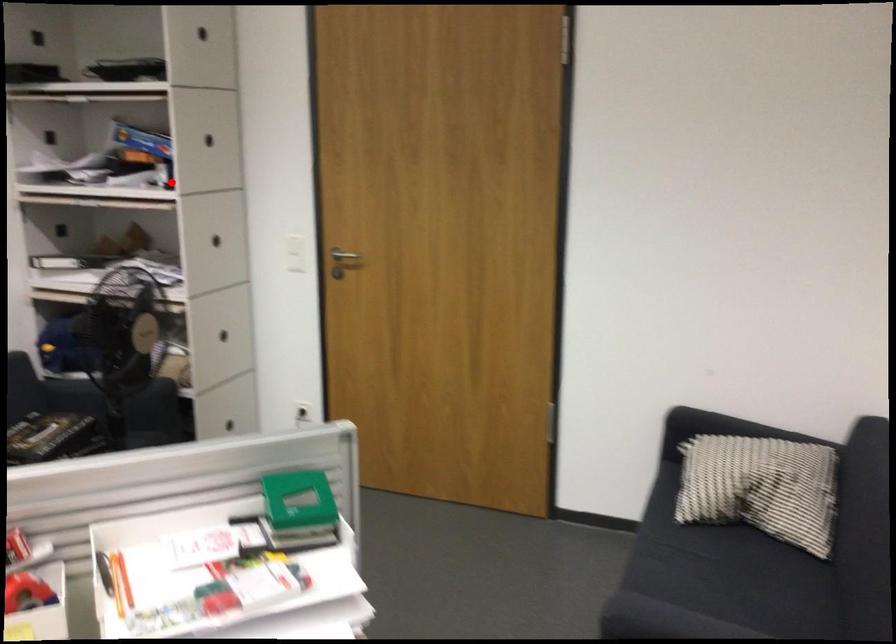
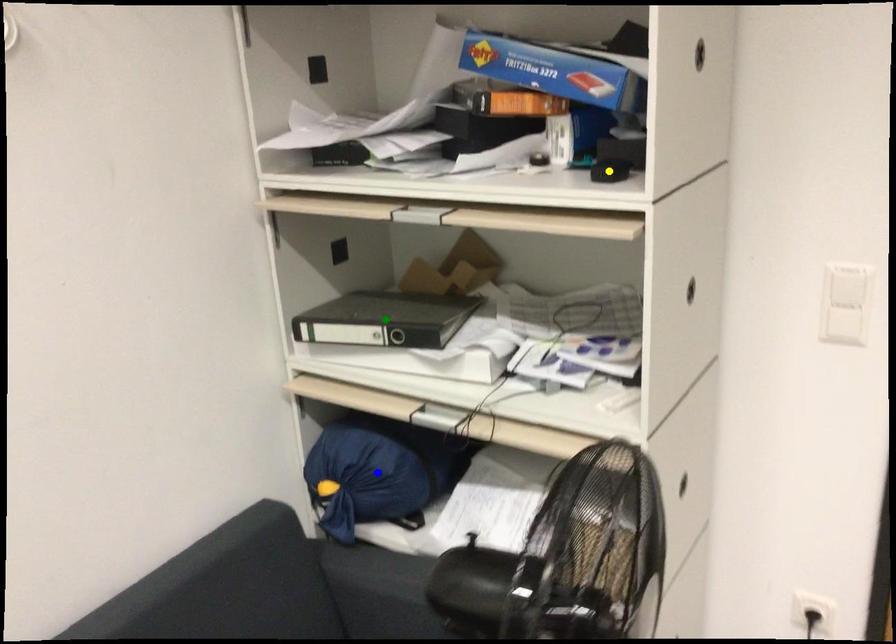
Question: I am providing you with two images of the same scene from different viewpoints. A red point is marked on the first image. You are given multiple points on the second image. Can you choose the point in image 2 that corresponds to the point in image 1?

Choices:
 (A) blue point
 (B) yellow point
 (C) green point

Answer: (B)